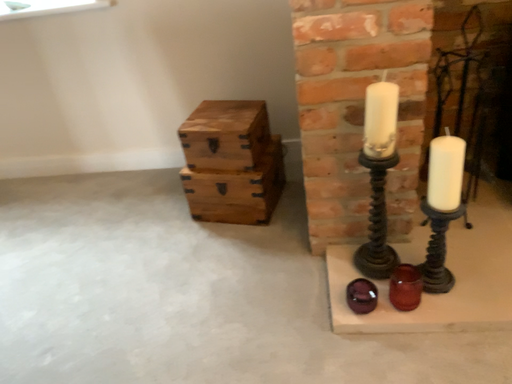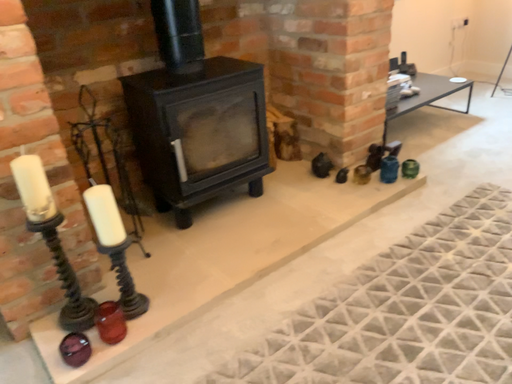
Question: Which way did the camera rotate in the video?

Choices:
 (A) rotated downward
 (B) rotated upward

Answer: (B)